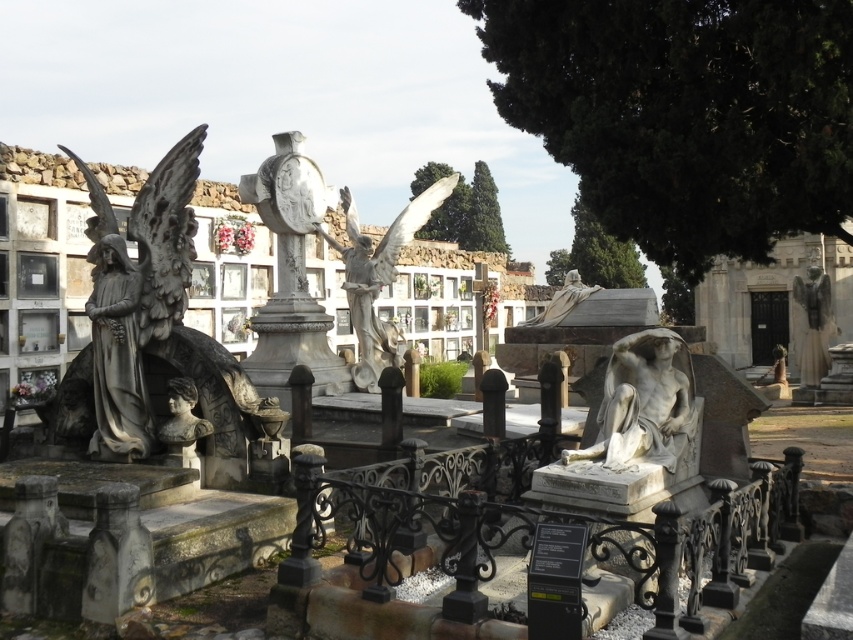
Question: Can you confirm if stone statue of an angel at left is positioned below matte stone bust at center?

Choices:
 (A) yes
 (B) no

Answer: (B)

Question: Does white marble angel at center have a smaller size compared to polished bronze angel at right?

Choices:
 (A) yes
 (B) no

Answer: (A)

Question: Is stone statue of an angel at left below white marble angel at center?

Choices:
 (A) yes
 (B) no

Answer: (B)

Question: Which is farther from the matte stone bust at center?

Choices:
 (A) polished bronze angel at right
 (B) white marble angel at center
 (C) white marble statue at center
 (D) stone statue of an angel at left

Answer: (A)

Question: Which point appears farthest from the camera in this image?

Choices:
 (A) (160, 333)
 (B) (808, 358)
 (C) (357, 292)

Answer: (B)

Question: Which is nearer to the stone statue of an angel at left?

Choices:
 (A) polished bronze angel at right
 (B) white marble angel at center
 (C) matte stone bust at center
 (D) white marble statue at center

Answer: (C)